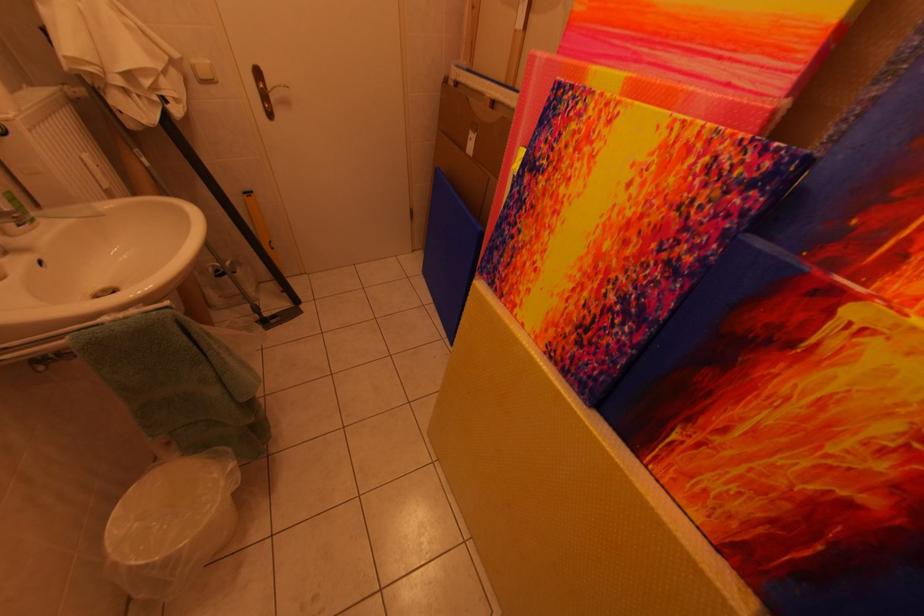
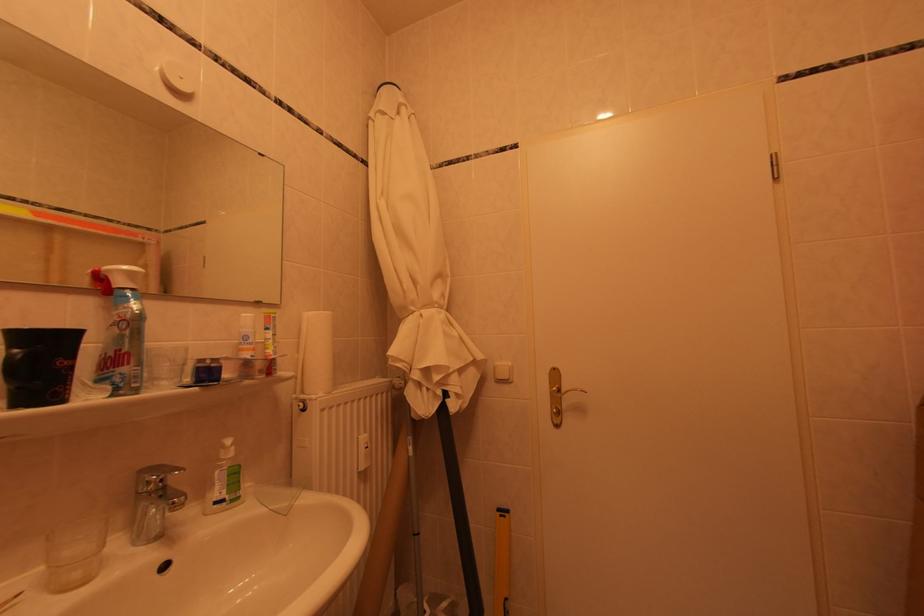
Where in the second image is the point corresponding to point 176,110 from the first image?

(456, 405)